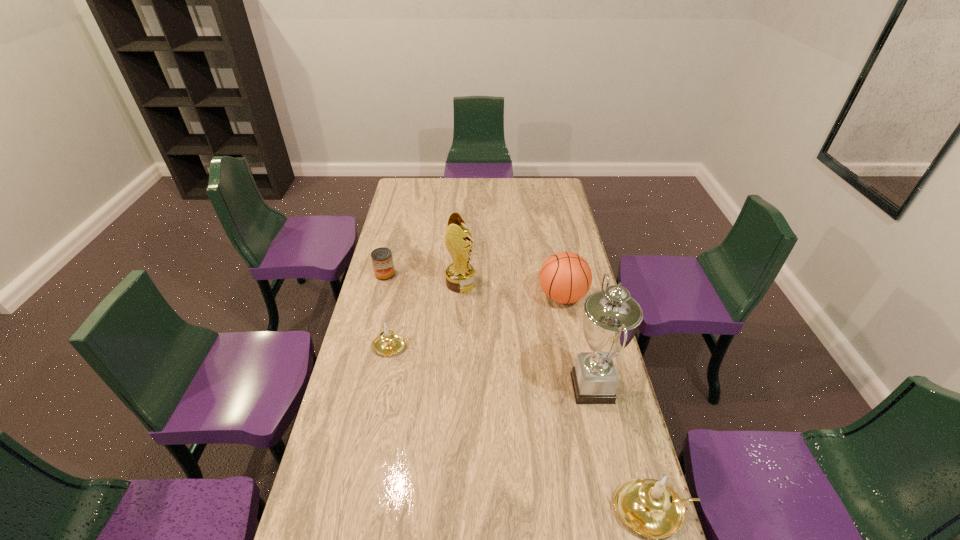
To make them evenly spaced by inserting another candle_holder among them, please locate a vacant spot for this new candle_holder. Please provide its 2D coordinates. Your answer should be formatted as a tuple, i.e. [(x, y)], where the tuple contains the x and y coordinates of a point satisfying the conditions above.

[(503, 415)]